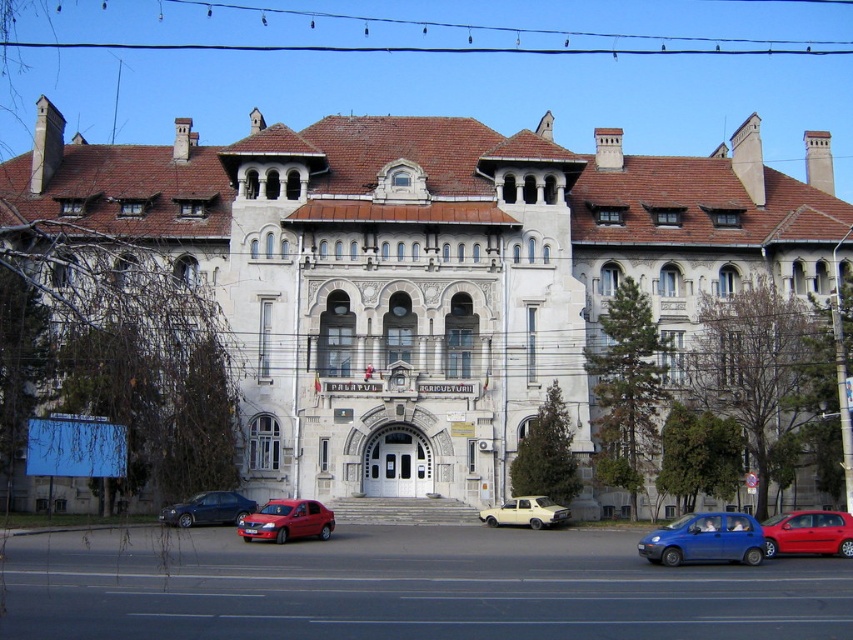
Does blue matte hatchback at lower right have a greater height compared to matte yellow car at center?

Correct, blue matte hatchback at lower right is much taller as matte yellow car at center.

Is point (671, 538) behind point (488, 513)?

No, (671, 538) is closer to viewer.

The image size is (853, 640). I want to click on blue matte hatchback at lower right, so click(705, 540).

Who is shorter, metallic red car at center or shiny red sedan at center?

shiny red sedan at center is shorter.

Can you confirm if metallic red car at center is smaller than shiny red sedan at center?

No.

The width and height of the screenshot is (853, 640). Identify the location of metallic red car at center. click(x=808, y=532).

Can you confirm if blue matte hatchback at lower right is positioned above metallic blue sedan at lower center?

Indeed, blue matte hatchback at lower right is positioned over metallic blue sedan at lower center.

Who is taller, blue matte hatchback at lower right or metallic blue sedan at lower center?

Standing taller between the two is blue matte hatchback at lower right.

What are the coordinates of `blue matte hatchback at lower right` in the screenshot? It's located at (705, 540).